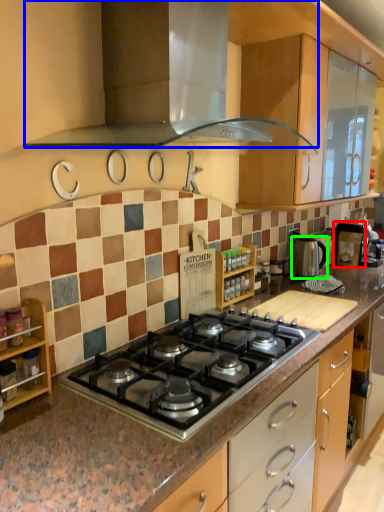
Question: Which object is the farthest from appliance (highlighted by a red box)? Choose among these: home appliance (highlighted by a blue box) or kitchen appliance (highlighted by a green box).

Choices:
 (A) home appliance
 (B) kitchen appliance

Answer: (A)